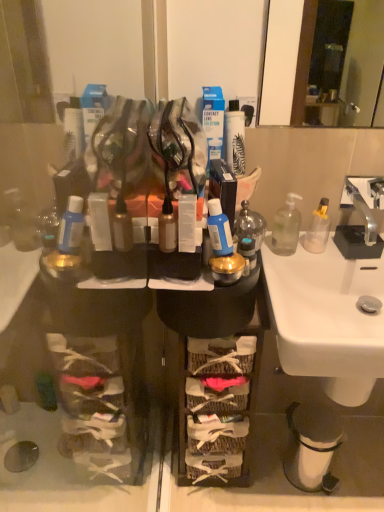
Question: Considering the relative sizes of translucent glass bottle at center, acting as the third bottle starting from the right, and blue matte bottle at center, which is counted as the 2th toiletry, starting from the right, in the image provided, is translucent glass bottle at center, acting as the third bottle starting from the right, taller than blue matte bottle at center, which is counted as the 2th toiletry, starting from the right,?

Choices:
 (A) yes
 (B) no

Answer: (A)

Question: Is there a large distance between translucent glass bottle at center, acting as the third bottle starting from the right, and blue matte bottle at center, which ranks as the second toiletry in left-to-right order?

Choices:
 (A) no
 (B) yes

Answer: (A)

Question: Is translucent glass bottle at center, acting as the third bottle starting from the right, positioned in front of blue matte bottle at center, which ranks as the second toiletry in left-to-right order?

Choices:
 (A) yes
 (B) no

Answer: (B)

Question: Can you confirm if translucent glass bottle at center, the 1th bottle viewed from the left, is positioned to the left of blue matte bottle at center, which is counted as the 2th toiletry, starting from the right?

Choices:
 (A) no
 (B) yes

Answer: (A)

Question: From a real-world perspective, is translucent glass bottle at center, acting as the third bottle starting from the right, under blue matte bottle at center, which is counted as the 2th toiletry, starting from the right?

Choices:
 (A) yes
 (B) no

Answer: (A)

Question: Is point (226, 239) positioned closer to the camera than point (248, 228)?

Choices:
 (A) farther
 (B) closer

Answer: (B)

Question: In the image, is blue matte bottle at center, which is counted as the 2th toiletry, starting from the right, on the left side or the right side of translucent glass bottle at center, acting as the third bottle starting from the right?

Choices:
 (A) right
 (B) left

Answer: (B)

Question: In terms of height, does blue matte bottle at center, which is counted as the 2th toiletry, starting from the right, look taller or shorter compared to translucent glass bottle at center, the 1th bottle viewed from the left?

Choices:
 (A) short
 (B) tall

Answer: (A)

Question: From a real-world perspective, is blue matte bottle at center, which is counted as the 2th toiletry, starting from the right, positioned above or below translucent glass bottle at center, acting as the third bottle starting from the right?

Choices:
 (A) above
 (B) below

Answer: (A)

Question: Is point (157, 234) closer or farther from the camera than point (249, 250)?

Choices:
 (A) closer
 (B) farther

Answer: (A)

Question: Considering the positions of matte plastic container at center, the third toiletry in the right-to-left sequence, and translucent plastic bottle at center, positioned as the 1th toiletry in right-to-left order, in the image, is matte plastic container at center, the third toiletry in the right-to-left sequence, bigger or smaller than translucent plastic bottle at center, positioned as the 1th toiletry in right-to-left order,?

Choices:
 (A) small
 (B) big

Answer: (A)

Question: From their relative heights in the image, would you say matte plastic container at center, the third toiletry in the right-to-left sequence, is taller or shorter than translucent plastic bottle at center, the 3th toiletry in the left-to-right sequence?

Choices:
 (A) short
 (B) tall

Answer: (B)

Question: Based on their positions, is matte plastic container at center, arranged as the 1th toiletry when viewed from the left, located to the left or right of translucent plastic bottle at center, positioned as the 1th toiletry in right-to-left order?

Choices:
 (A) left
 (B) right

Answer: (A)

Question: Which is correct: translucent plastic bottle at center, the 3th toiletry in the left-to-right sequence, is inside matte plastic container at center, arranged as the 1th toiletry when viewed from the left, or outside of it?

Choices:
 (A) inside
 (B) outside

Answer: (B)

Question: In terms of width, does translucent plastic bottle at center, the 3th toiletry in the left-to-right sequence, look wider or thinner when compared to matte plastic container at center, the third toiletry in the right-to-left sequence?

Choices:
 (A) wide
 (B) thin

Answer: (A)